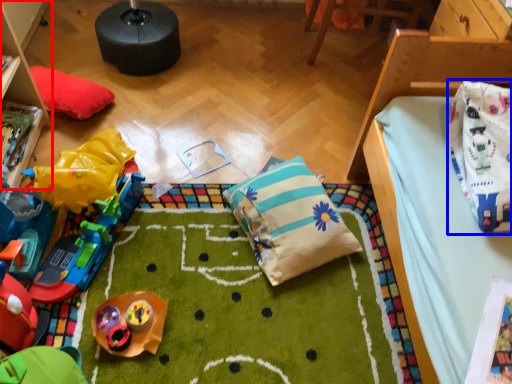
Question: Among these objects, which one is farthest to the camera, furniture (highlighted by a red box) or material (highlighted by a blue box)?

Choices:
 (A) furniture
 (B) material

Answer: (A)